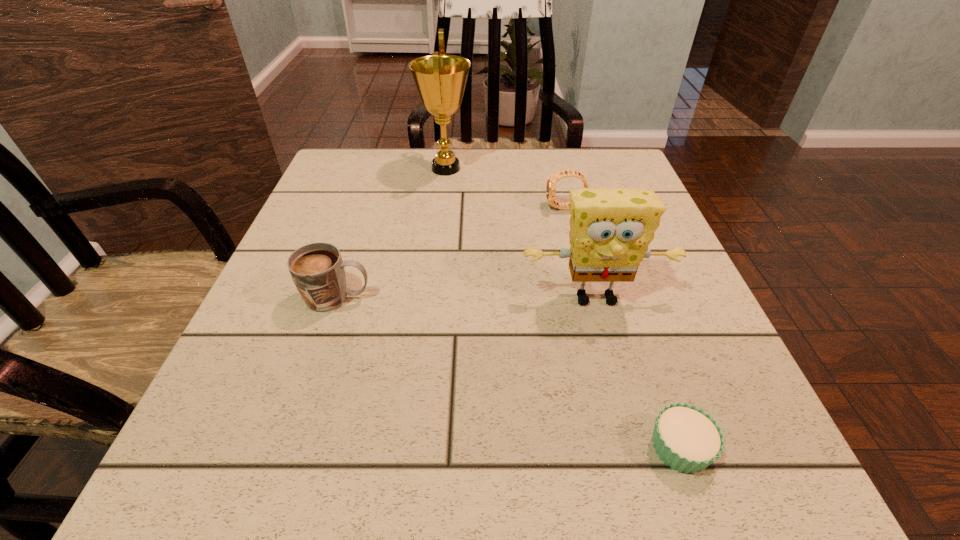
Identify the location of free location located 0.260m on the face of the watch. Image resolution: width=960 pixels, height=540 pixels. (430, 208).

Where is `vacant region located 0.300m on the face of the watch`? The image size is (960, 540). vacant region located 0.300m on the face of the watch is located at coordinates (412, 208).

Identify the location of free spot located on the face of the watch. The height and width of the screenshot is (540, 960). (484, 208).

The width and height of the screenshot is (960, 540). I want to click on vacant space situated 0.080m on the back of the cupcake, so tap(654, 370).

Where is `object present at the far edge`? This screenshot has height=540, width=960. object present at the far edge is located at coordinates (440, 79).

Locate an element on the screen. object present at the near edge is located at coordinates (687, 439).

Locate an element on the screen. Image resolution: width=960 pixels, height=540 pixels. object that is at the left edge is located at coordinates (317, 269).

Locate an element on the screen. sponge that is at the right edge is located at coordinates (610, 229).

At what (x,y) coordinates should I click in order to perform the action: click on watch that is at the right edge. Please return your answer as a coordinate pair (x, y). This screenshot has width=960, height=540. Looking at the image, I should click on (554, 178).

The image size is (960, 540). What are the coordinates of `cupcake that is positioned at the right edge` in the screenshot? It's located at (687, 439).